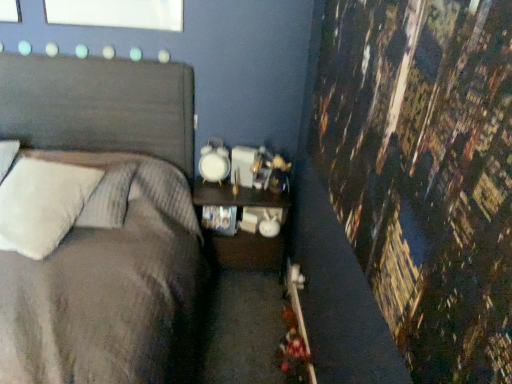
Question: Is wooden nightstand at center inside the boundaries of textured gray bed at left, or outside?

Choices:
 (A) inside
 (B) outside

Answer: (B)

Question: Does point (217, 192) appear closer or farther from the camera than point (141, 165)?

Choices:
 (A) farther
 (B) closer

Answer: (A)

Question: Which object is the closest to the textured gray bed at left?

Choices:
 (A) wooden nightstand at center
 (B) white fluffy pillow at left

Answer: (B)

Question: Which object is positioned farthest from the textured gray bed at left?

Choices:
 (A) white fluffy pillow at left
 (B) wooden nightstand at center

Answer: (B)